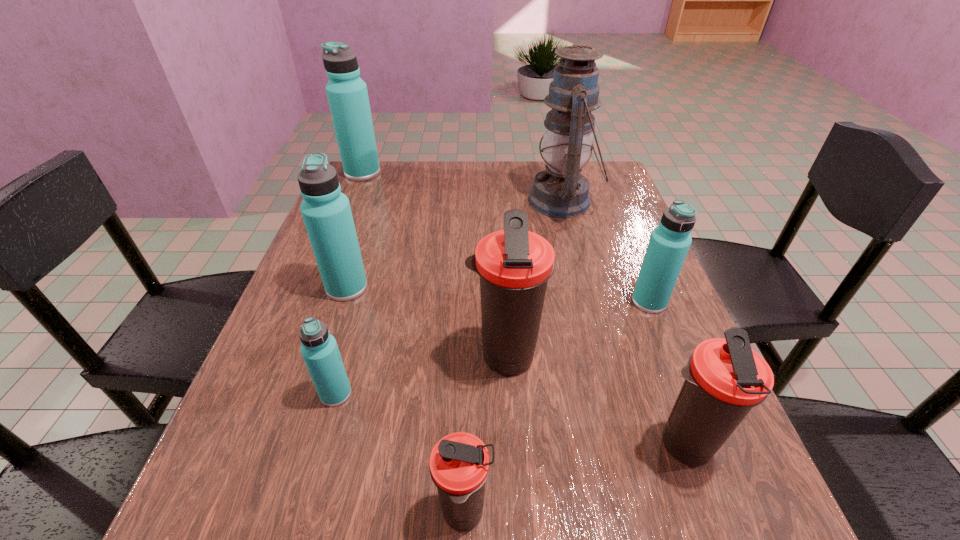
You are a GUI agent. You are given a task and a screenshot of the screen. Output one action in this format:
    pyautogui.click(x=<x>, y=<y>)
    Task: Click on the blank space located on the right of the farthest thermos bottle
    The height and width of the screenshot is (540, 960).
    Given the screenshot: What is the action you would take?
    pyautogui.click(x=407, y=173)

The image size is (960, 540). Find the location of `vacant area located on the left of the farthest brown thermos bottle`. vacant area located on the left of the farthest brown thermos bottle is located at coordinates (290, 358).

Where is `vacant point located on the front of the second biggest aqua thermos bottle`? vacant point located on the front of the second biggest aqua thermos bottle is located at coordinates (333, 331).

Locate an element on the screen. This screenshot has width=960, height=540. free space located 0.210m on the left of the second farthest brown thermos bottle is located at coordinates (515, 446).

You are a GUI agent. You are given a task and a screenshot of the screen. Output one action in this format:
    pyautogui.click(x=<x>, y=<y>)
    Task: Click on the vacant area situated 0.360m on the left of the second smallest aqua thermos bottle
    The width and height of the screenshot is (960, 540).
    Given the screenshot: What is the action you would take?
    pyautogui.click(x=461, y=302)

Locate an element on the screen. free space located 0.290m on the right of the smallest aqua thermos bottle is located at coordinates (519, 394).

Find the location of a particular element. This screenshot has height=540, width=960. oil lamp that is positioned at the far edge is located at coordinates (560, 191).

In order to click on thermos bottle located at the far edge in this screenshot , I will do `click(347, 94)`.

I want to click on oil lamp that is at the right edge, so click(560, 191).

At what (x,y) coordinates should I click in order to perform the action: click on object that is at the far left corner. Please return your answer as a coordinate pair (x, y). Looking at the image, I should click on (347, 94).